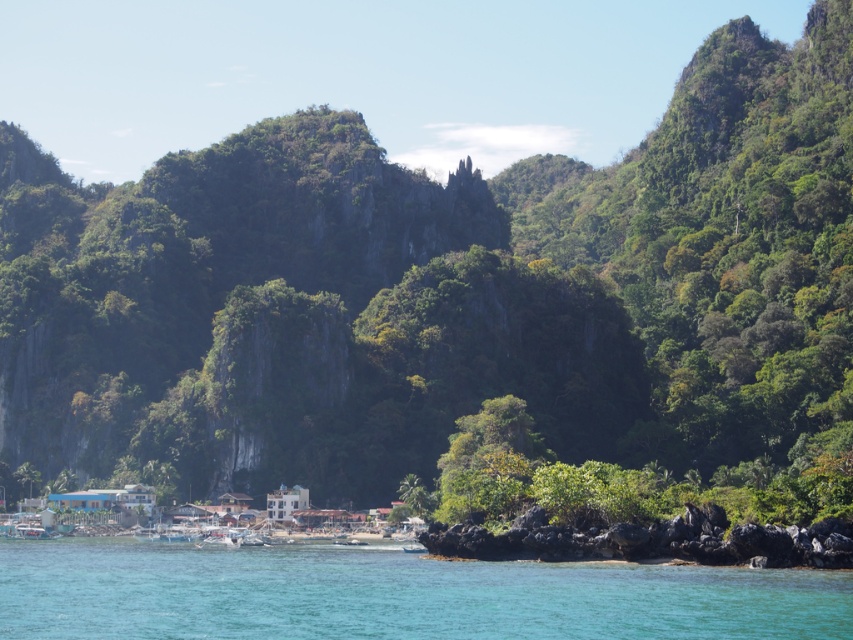
You are a kayaker planning to navigate through the coastal area shown in the image. You need to pass between the clear blue water at lower center and the volcanic rock at lower right. Based on the scene, which of these two features is wider?

The clear blue water at lower center is wider than the volcanic rock at lower right, as its width surpasses that of the volcanic rock.

You are a snorkeler who wants to explore the area. You have a choice between the clear blue water at lower center and the volcanic rock at lower right. Which location offers more space to move around comfortably?

The clear blue water at lower center has a larger size compared to the volcanic rock at lower right, so it offers more space to move around comfortably.